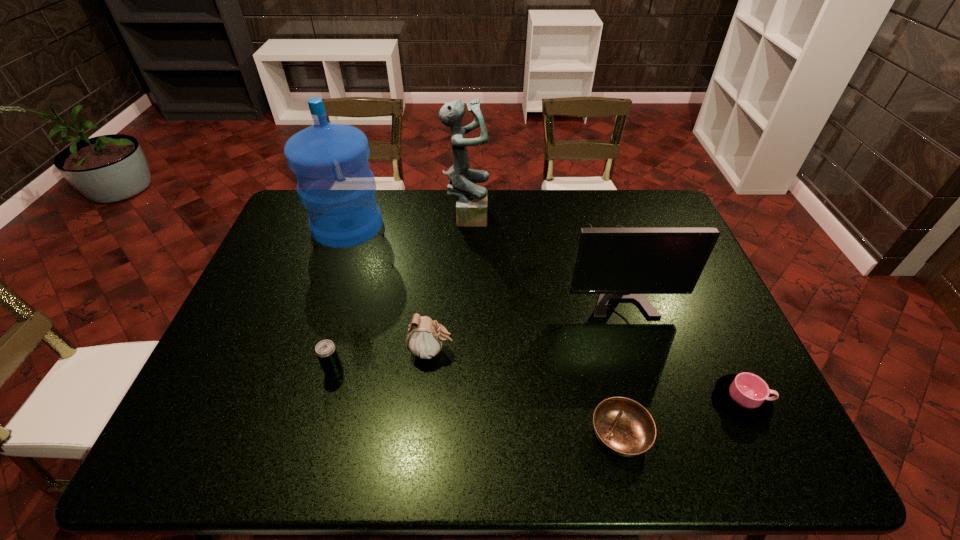
Where is `object that is at the far left corner`? object that is at the far left corner is located at coordinates (335, 184).

This screenshot has height=540, width=960. I want to click on object located in the far right corner section of the desktop, so click(x=621, y=263).

Locate an element on the screen. This screenshot has height=540, width=960. vacant point at the far edge is located at coordinates (613, 208).

The height and width of the screenshot is (540, 960). I want to click on vacant space at the near edge of the desktop, so click(x=264, y=431).

Image resolution: width=960 pixels, height=540 pixels. Find the location of `free space at the left edge of the desktop`. free space at the left edge of the desktop is located at coordinates [x=276, y=252].

In the image, there is a desktop. In order to click on vacant space at the far left corner in this screenshot , I will do `click(302, 228)`.

This screenshot has height=540, width=960. What are the coordinates of `vacant space at the near left corner of the desktop` in the screenshot? It's located at (236, 457).

This screenshot has height=540, width=960. Identify the location of vacant area that lies between the soup bowl and the fourth shortest object. (526, 393).

At what (x,y) coordinates should I click in order to perform the action: click on vacant space in between the computer monitor and the sculpture. Please return your answer as a coordinate pair (x, y). The image size is (960, 540). Looking at the image, I should click on (540, 242).

The height and width of the screenshot is (540, 960). I want to click on blank region between the sculpture and the computer monitor, so click(x=540, y=242).